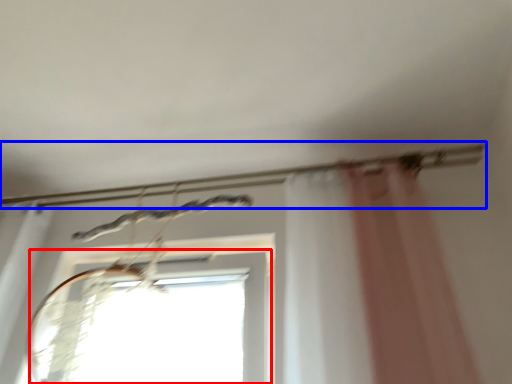
Question: Which object appears closest to the camera in this image, window (highlighted by a red box) or clothesline (highlighted by a blue box)?

Choices:
 (A) window
 (B) clothesline

Answer: (A)